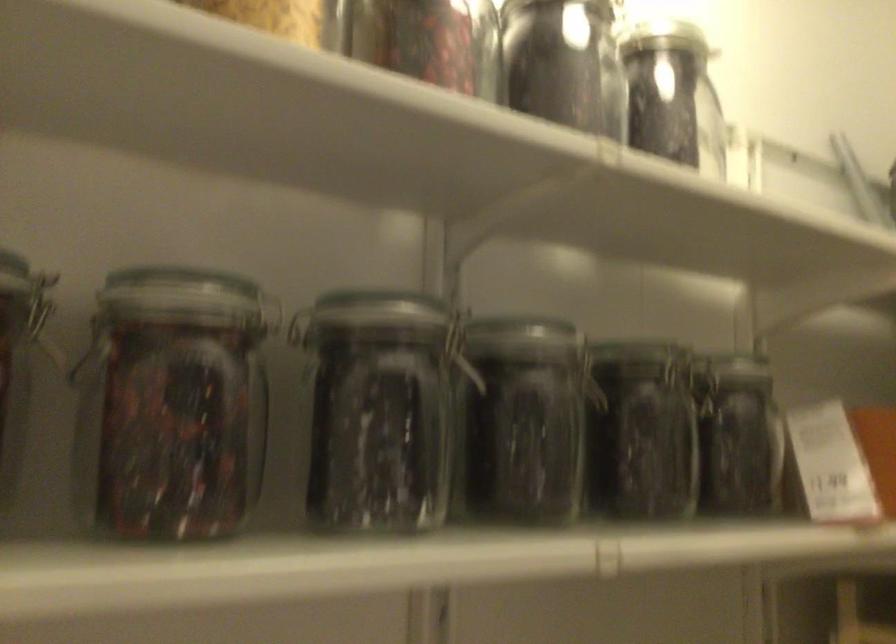
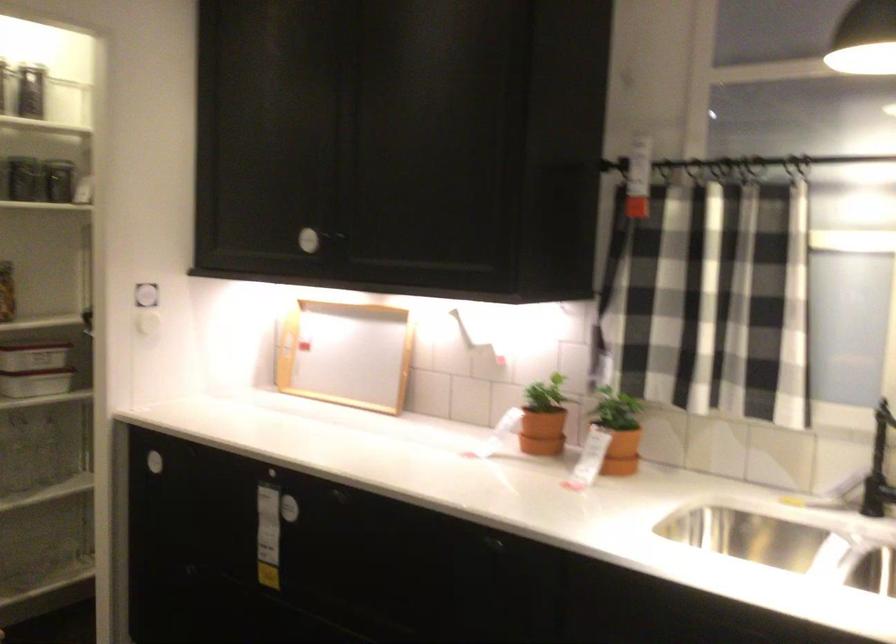
Where in the second image is the point corresponding to the point at 692,466 from the first image?

(31, 187)